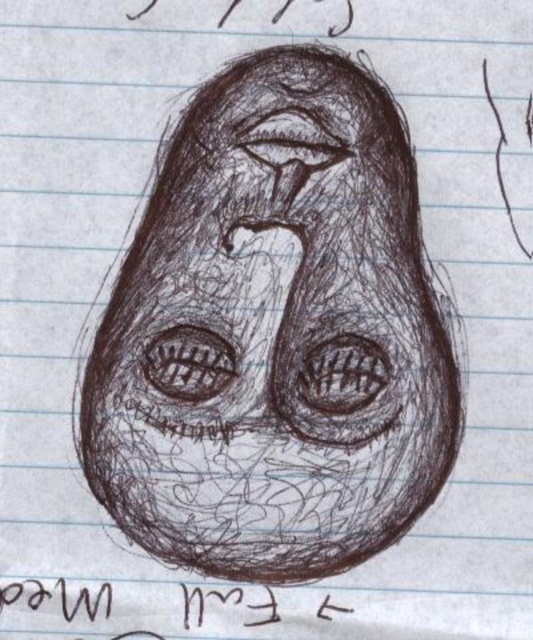
Does charcoal sketch face at center appear under brown ink text at bottom?

Incorrect, charcoal sketch face at center is not positioned below brown ink text at bottom.

Who is positioned more to the left, charcoal sketch face at center or brown ink text at bottom?

brown ink text at bottom is more to the left.

This screenshot has width=533, height=640. What do you see at coordinates (274, 332) in the screenshot? I see `charcoal sketch face at center` at bounding box center [274, 332].

Identify the location of charcoal sketch face at center. (274, 332).